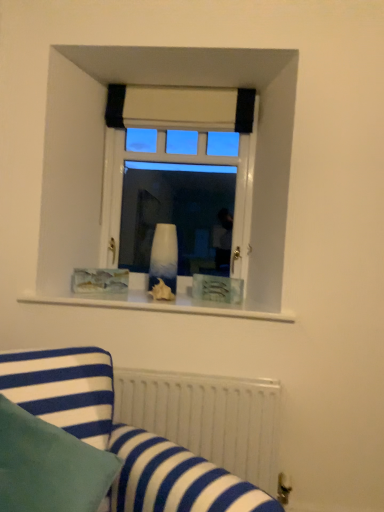
Question: Are white matte radiator at lower center and white glossy vase at center making contact?

Choices:
 (A) no
 (B) yes

Answer: (A)

Question: Considering the relative sizes of white matte radiator at lower center and white glossy vase at center in the image provided, is white matte radiator at lower center wider than white glossy vase at center?

Choices:
 (A) no
 (B) yes

Answer: (B)

Question: From the image's perspective, is white matte radiator at lower center located beneath white glossy vase at center?

Choices:
 (A) no
 (B) yes

Answer: (B)

Question: Can you confirm if white matte radiator at lower center is bigger than white glossy vase at center?

Choices:
 (A) no
 (B) yes

Answer: (B)

Question: Is white matte radiator at lower center shorter than white glossy vase at center?

Choices:
 (A) yes
 (B) no

Answer: (A)

Question: Is white glossy vase at center in front of or behind blue striped fabric at lower left in the image?

Choices:
 (A) front
 (B) behind

Answer: (B)

Question: From a real-world perspective, is white glossy vase at center above or below blue striped fabric at lower left?

Choices:
 (A) above
 (B) below

Answer: (A)

Question: Is white glossy vase at center inside or outside of blue striped fabric at lower left?

Choices:
 (A) inside
 (B) outside

Answer: (B)

Question: Looking at the image, does white glossy vase at center seem bigger or smaller compared to blue striped fabric at lower left?

Choices:
 (A) small
 (B) big

Answer: (A)

Question: Looking at the image, does white glossy vase at center seem bigger or smaller compared to white glossy vase at center?

Choices:
 (A) big
 (B) small

Answer: (B)

Question: From the image's perspective, is white glossy vase at center positioned above or below white glossy vase at center?

Choices:
 (A) below
 (B) above

Answer: (A)

Question: From their relative heights in the image, would you say white glossy vase at center is taller or shorter than white glossy vase at center?

Choices:
 (A) tall
 (B) short

Answer: (B)

Question: Is white glossy vase at center inside the boundaries of white glossy vase at center, or outside?

Choices:
 (A) outside
 (B) inside

Answer: (A)

Question: From a real-world perspective, is white matte radiator at lower center above or below white glossy vase at center?

Choices:
 (A) below
 (B) above

Answer: (A)

Question: Considering the positions of white matte radiator at lower center and white glossy vase at center in the image, is white matte radiator at lower center taller or shorter than white glossy vase at center?

Choices:
 (A) tall
 (B) short

Answer: (B)